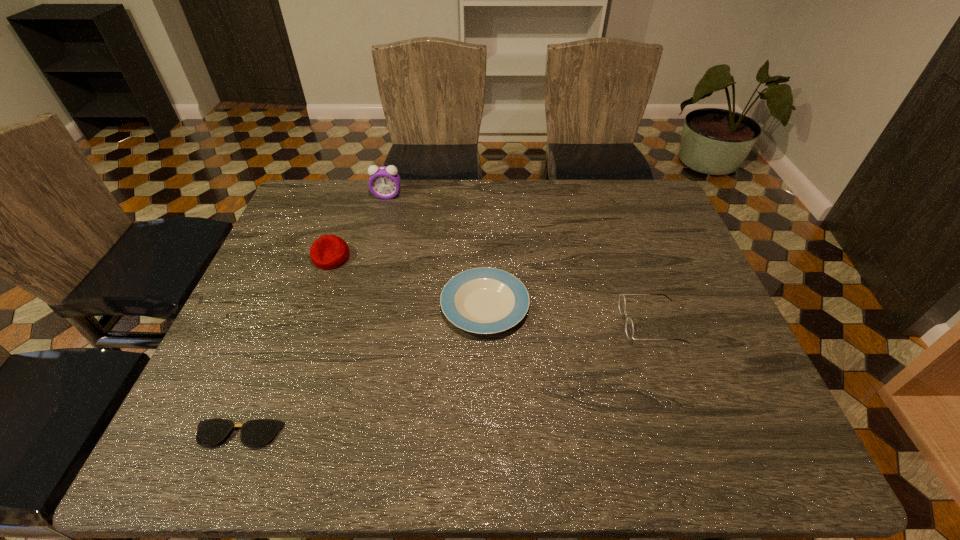
I want to click on free space that is in between the third tallest object and the shorter spectacles, so click(x=444, y=379).

Image resolution: width=960 pixels, height=540 pixels. In order to click on vacant space that is in between the right spectacles and the plate in this screenshot , I will do `click(567, 314)`.

Locate an element on the screen. Image resolution: width=960 pixels, height=540 pixels. vacant region between the alarm clock and the shortest object is located at coordinates (312, 315).

Where is `vacant space in between the fourth tallest object and the nearer spectacles`? vacant space in between the fourth tallest object and the nearer spectacles is located at coordinates (361, 370).

This screenshot has width=960, height=540. I want to click on free space between the third shortest object and the farthest object, so click(519, 259).

Identify the location of empty space that is in between the nearest object and the fourth shortest object. (284, 346).

Identify the location of vacant area between the fourth object from left to right and the third tallest object. (567, 314).

You are a GUI agent. You are given a task and a screenshot of the screen. Output one action in this format:
    pyautogui.click(x=<x>, y=<y>)
    Task: Click on the vacant space that's between the nearer spectacles and the second shortest object
    Image resolution: width=960 pixels, height=540 pixels.
    Given the screenshot: What is the action you would take?
    pyautogui.click(x=361, y=370)

Locate an element on the screen. This screenshot has height=540, width=960. vacant space that is in between the fourth tallest object and the tallest object is located at coordinates [436, 251].

You are a GUI agent. You are given a task and a screenshot of the screen. Output one action in this format:
    pyautogui.click(x=<x>, y=<y>)
    Task: Click on the closest object to the farthest object
    The width and height of the screenshot is (960, 540).
    Given the screenshot: What is the action you would take?
    pyautogui.click(x=329, y=251)